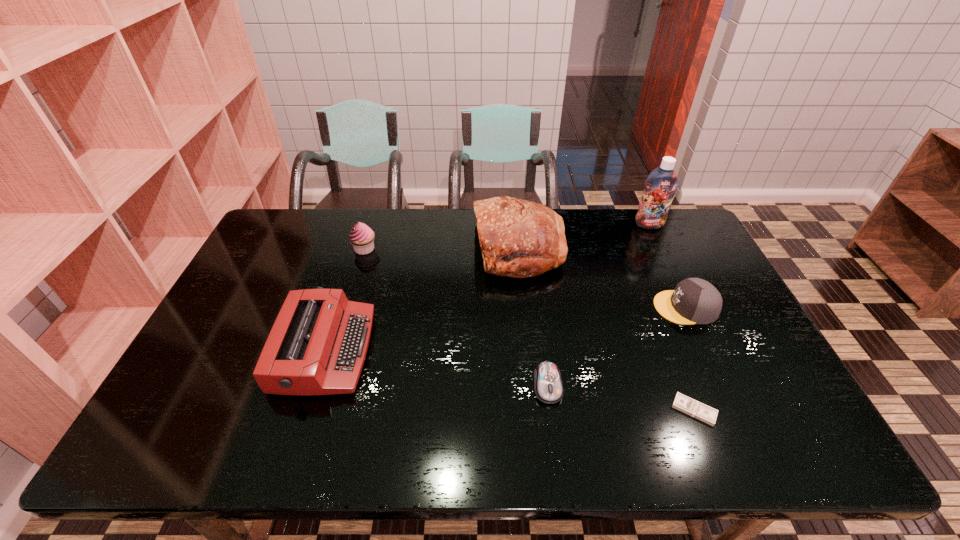
Locate an element on the screen. The image size is (960, 540). vacant space that satisfies the following two spatial constraints: 1. on the typing side of the fourth tallest object; 2. on the back side of the shortest object is located at coordinates (306, 410).

The image size is (960, 540). Identify the location of free space in the image that satisfies the following two spatial constraints: 1. on the wheel side of the money; 2. on the left side of the computer mouse. (551, 410).